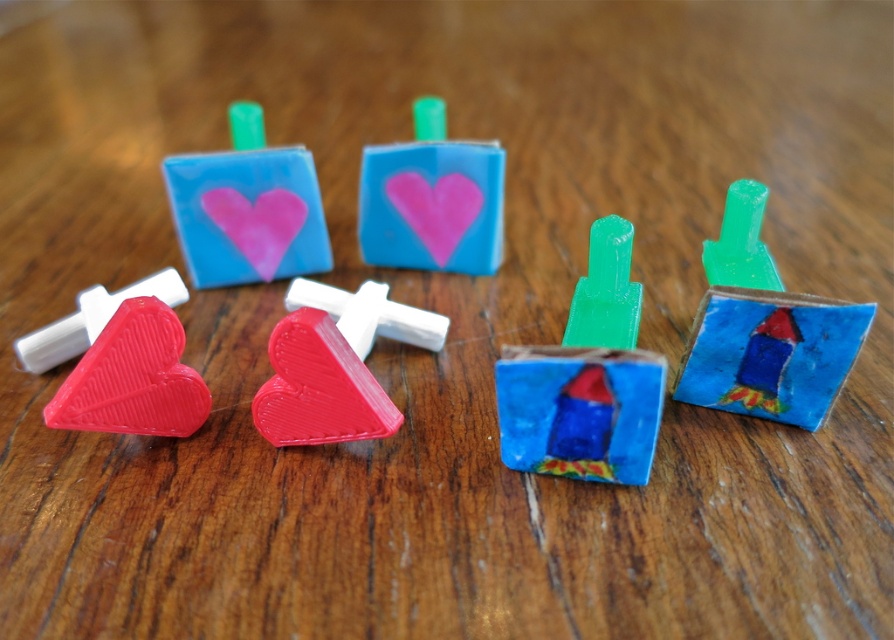
Which is below, matte pink heart at center or pink matte heart at center?

matte pink heart at center is below.

Can you confirm if matte pink heart at center is shorter than pink matte heart at center?

Indeed, matte pink heart at center has a lesser height compared to pink matte heart at center.

Who is more forward, (230, 228) or (437, 243)?

Point (230, 228) is more forward.

This screenshot has height=640, width=894. In order to click on matte pink heart at center in this screenshot , I will do `click(257, 224)`.

Who is positioned more to the left, matte red heart at lower left or matte plastic heart at center?

matte red heart at lower left is more to the left.

Can you confirm if matte red heart at lower left is thinner than matte plastic heart at center?

Correct, matte red heart at lower left's width is less than matte plastic heart at center's.

At what (x,y) coordinates should I click in order to perform the action: click on matte red heart at lower left. Please return your answer as a coordinate pair (x, y). This screenshot has width=894, height=640. Looking at the image, I should click on (133, 378).

Is matte plastic heart at center smaller than matte pink heart at center?

Incorrect, matte plastic heart at center is not smaller in size than matte pink heart at center.

Where is `matte plastic heart at center`? The image size is (894, 640). matte plastic heart at center is located at coordinates (318, 387).